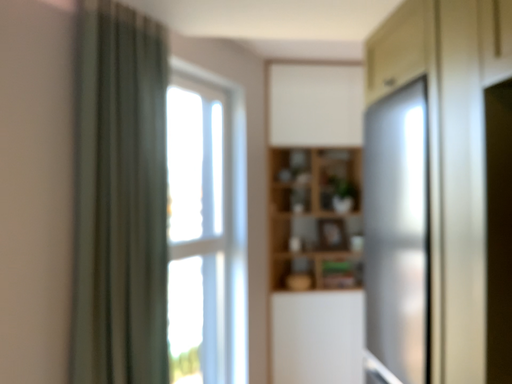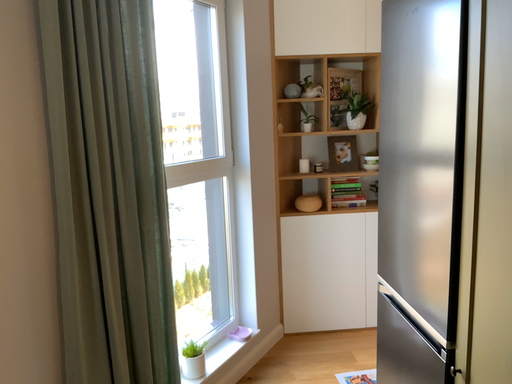
Question: Which way did the camera rotate in the video?

Choices:
 (A) rotated upward
 (B) rotated downward

Answer: (B)